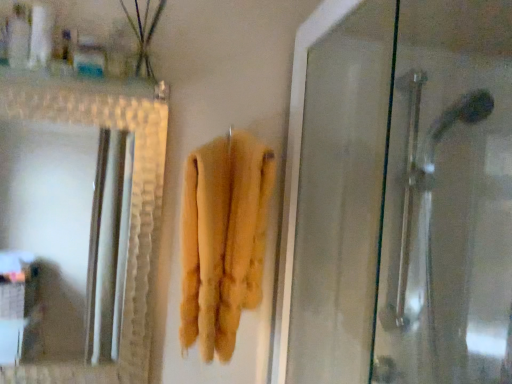
Measure the distance between white plastic container at upper left, which is counted as the 2th toiletry, starting from the right, and camera.

They are 95.83 centimeters apart.

This screenshot has width=512, height=384. Identify the location of white plastic container at upper left, which is counted as the 2th toiletry, starting from the right. (18, 36).

What is the approximate height of translucent plastic container at upper left, arranged as the second toiletry when viewed from the left?

translucent plastic container at upper left, arranged as the second toiletry when viewed from the left, is 8.48 centimeters tall.

The height and width of the screenshot is (384, 512). I want to click on green matte plant at upper left, so click(x=144, y=35).

Find the location of a particular element. The width and height of the screenshot is (512, 384). white plastic container at upper left, the 1th toiletry when ordered from left to right is located at coordinates (18, 36).

Which is more to the right, green matte plant at upper left or white plastic container at upper left, the 1th toiletry when ordered from left to right?

green matte plant at upper left is more to the right.

Is green matte plant at upper left far from white plastic container at upper left, the 1th toiletry when ordered from left to right?

Actually, green matte plant at upper left and white plastic container at upper left, the 1th toiletry when ordered from left to right, are a little close together.

Does green matte plant at upper left have a lesser width compared to white plastic container at upper left, which is counted as the 2th toiletry, starting from the right?

Yes.

Does point (123, 6) appear closer or farther from the camera than point (17, 37)?

Clearly, point (123, 6) is more distant from the camera than point (17, 37).

Considering the positions of points (29, 45) and (157, 16), is point (29, 45) farther from camera compared to point (157, 16)?

No, (29, 45) is in front of (157, 16).

From a real-world perspective, is white plastic container at upper left, the 1th toiletry when ordered from left to right, above or below green matte plant at upper left?

In terms of real-world spatial position, white plastic container at upper left, the 1th toiletry when ordered from left to right, is below green matte plant at upper left.

Can you confirm if white plastic container at upper left, which is counted as the 2th toiletry, starting from the right, is wider than green matte plant at upper left?

Correct, the width of white plastic container at upper left, which is counted as the 2th toiletry, starting from the right, exceeds that of green matte plant at upper left.

Is white plastic container at upper left, the 1th toiletry when ordered from left to right, situated inside green matte plant at upper left or outside?

white plastic container at upper left, the 1th toiletry when ordered from left to right, is spatially situated outside green matte plant at upper left.

Is yellow fluffy towel at center wider or thinner than green matte plant at upper left?

Clearly, yellow fluffy towel at center has more width compared to green matte plant at upper left.

From the image's perspective, which is above, yellow fluffy towel at center or green matte plant at upper left?

green matte plant at upper left.

Which of these two, yellow fluffy towel at center or green matte plant at upper left, stands taller?

yellow fluffy towel at center.

Does yellow fluffy towel at center have a smaller size compared to green matte plant at upper left?

No.

Is translucent plastic container at upper left, the first toiletry viewed from the right, oriented towards white plastic container at upper left, the 1th toiletry when ordered from left to right?

No.

Does translucent plastic container at upper left, the first toiletry viewed from the right, have a greater height compared to white plastic container at upper left, the 1th toiletry when ordered from left to right?

Incorrect, the height of translucent plastic container at upper left, the first toiletry viewed from the right, is not larger of that of white plastic container at upper left, the 1th toiletry when ordered from left to right.

In the scene shown: Is translucent plastic container at upper left, arranged as the second toiletry when viewed from the left, wider than white plastic container at upper left, which is counted as the 2th toiletry, starting from the right?

Indeed, translucent plastic container at upper left, arranged as the second toiletry when viewed from the left, has a greater width compared to white plastic container at upper left, which is counted as the 2th toiletry, starting from the right.

Is translucent plastic container at upper left, arranged as the second toiletry when viewed from the left, closer to the viewer compared to white plastic container at upper left, the 1th toiletry when ordered from left to right?

No, translucent plastic container at upper left, arranged as the second toiletry when viewed from the left, is further to the viewer.

Is translucent plastic container at upper left, the first toiletry viewed from the right, positioned beyond the bounds of yellow fluffy towel at center?

Absolutely, translucent plastic container at upper left, the first toiletry viewed from the right, is external to yellow fluffy towel at center.

Which of these two, translucent plastic container at upper left, the first toiletry viewed from the right, or yellow fluffy towel at center, is bigger?

With larger size is yellow fluffy towel at center.

Considering the relative positions of translucent plastic container at upper left, the first toiletry viewed from the right, and yellow fluffy towel at center in the image provided, is translucent plastic container at upper left, the first toiletry viewed from the right, to the left or to the right of yellow fluffy towel at center?

Based on their positions, translucent plastic container at upper left, the first toiletry viewed from the right, is located to the left of yellow fluffy towel at center.

Can you confirm if yellow fluffy towel at center is wider than translucent plastic container at upper left, arranged as the second toiletry when viewed from the left?

Yes.

Which object is further away from the camera, yellow fluffy towel at center or translucent plastic container at upper left, the first toiletry viewed from the right?

Positioned behind is translucent plastic container at upper left, the first toiletry viewed from the right.

This screenshot has width=512, height=384. I want to click on towel below the translucent plastic container at upper left, the first toiletry viewed from the right (from the image's perspective), so click(x=223, y=239).

Between point (249, 182) and point (104, 66), which one is positioned in front?

Positioned in front is point (249, 182).

Is translucent plastic container at upper left, the first toiletry viewed from the right, oriented towards green matte plant at upper left?

No, translucent plastic container at upper left, the first toiletry viewed from the right, is not facing towards green matte plant at upper left.

Is green matte plant at upper left inside translucent plastic container at upper left, the first toiletry viewed from the right?

No, green matte plant at upper left is located outside of translucent plastic container at upper left, the first toiletry viewed from the right.

Looking at the image, does translucent plastic container at upper left, arranged as the second toiletry when viewed from the left, seem bigger or smaller compared to green matte plant at upper left?

In the image, translucent plastic container at upper left, arranged as the second toiletry when viewed from the left, appears to be smaller than green matte plant at upper left.

Is translucent plastic container at upper left, arranged as the second toiletry when viewed from the left, closer to the viewer compared to green matte plant at upper left?

Yes, it is.

There is a green matte plant at upper left. Where is `the 1st toiletry below it (from a real-world perspective)`? This screenshot has width=512, height=384. the 1st toiletry below it (from a real-world perspective) is located at coordinates (18, 36).

I want to click on plant above the white plastic container at upper left, the 1th toiletry when ordered from left to right (from the image's perspective), so click(x=144, y=35).

When comparing their distances from white plastic container at upper left, the 1th toiletry when ordered from left to right, does translucent plastic container at upper left, the first toiletry viewed from the right, or green matte plant at upper left seem further?

green matte plant at upper left lies further to white plastic container at upper left, the 1th toiletry when ordered from left to right, than the other object.

Estimate the real-world distances between objects in this image. Which object is closer to translucent plastic container at upper left, arranged as the second toiletry when viewed from the left, white plastic container at upper left, the 1th toiletry when ordered from left to right, or yellow fluffy towel at center?

white plastic container at upper left, the 1th toiletry when ordered from left to right, is closer to translucent plastic container at upper left, arranged as the second toiletry when viewed from the left.

Which object lies nearer to the anchor point translucent plastic container at upper left, arranged as the second toiletry when viewed from the left, green matte plant at upper left or yellow fluffy towel at center?

green matte plant at upper left is positioned closer to the anchor translucent plastic container at upper left, arranged as the second toiletry when viewed from the left.

Looking at the image, which one is located closer to white plastic container at upper left, which is counted as the 2th toiletry, starting from the right, translucent plastic container at upper left, arranged as the second toiletry when viewed from the left, or yellow fluffy towel at center?

The object closer to white plastic container at upper left, which is counted as the 2th toiletry, starting from the right, is translucent plastic container at upper left, arranged as the second toiletry when viewed from the left.

From the image, which object appears to be farther from translucent plastic container at upper left, arranged as the second toiletry when viewed from the left, green matte plant at upper left or white plastic container at upper left, the 1th toiletry when ordered from left to right?

Based on the image, white plastic container at upper left, the 1th toiletry when ordered from left to right, appears to be further to translucent plastic container at upper left, arranged as the second toiletry when viewed from the left.

Which object lies further to the anchor point yellow fluffy towel at center, translucent plastic container at upper left, arranged as the second toiletry when viewed from the left, or green matte plant at upper left?

Among the two, translucent plastic container at upper left, arranged as the second toiletry when viewed from the left, is located further to yellow fluffy towel at center.

From the image, which object appears to be nearer to green matte plant at upper left, white plastic container at upper left, the 1th toiletry when ordered from left to right, or yellow fluffy towel at center?

white plastic container at upper left, the 1th toiletry when ordered from left to right, lies closer to green matte plant at upper left than the other object.

Estimate the real-world distances between objects in this image. Which object is further from translucent plastic container at upper left, arranged as the second toiletry when viewed from the left, yellow fluffy towel at center or white plastic container at upper left, the 1th toiletry when ordered from left to right?

yellow fluffy towel at center is further to translucent plastic container at upper left, arranged as the second toiletry when viewed from the left.

I want to click on toiletry situated between white plastic container at upper left, the 1th toiletry when ordered from left to right, and green matte plant at upper left from left to right, so pos(89,58).

Find the location of `toiletry between white plastic container at upper left, the 1th toiletry when ordered from left to right, and yellow fluffy towel at center vertically`. toiletry between white plastic container at upper left, the 1th toiletry when ordered from left to right, and yellow fluffy towel at center vertically is located at coordinates (89, 58).